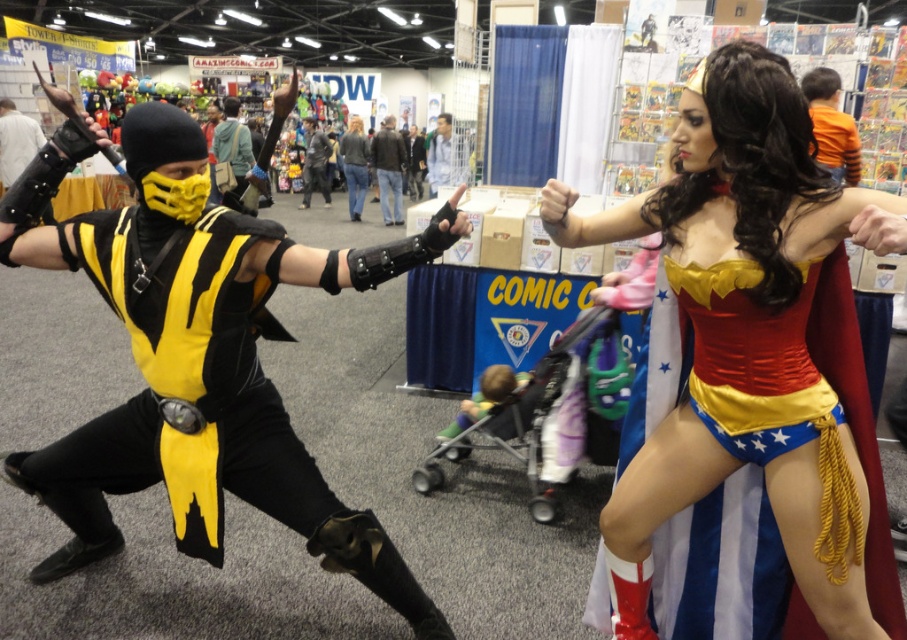
You are standing at the convention and want to take a photo of the point at coordinates point (808, 104). If you need to be within 3 meters to get a clear shot, can you take the photo from where you are?

The distance of point (808, 104) from viewer is 2.60 meters, so yes, you can take the photo from your current position as you are within the 3 meters requirement.

You are a photographer at the convention and need to capture a clear shot of both the denim jeans at center and the blue fabric shirt at center. Since you want both items to be in focus, which one should you adjust your camera focus on first to ensure depth of field?

The denim jeans at center is closer to the viewer than the blue fabric shirt at center. To ensure both are in focus, you should focus on the denim jeans at center first, as it is the closer object, and use a smaller aperture for greater depth of field.